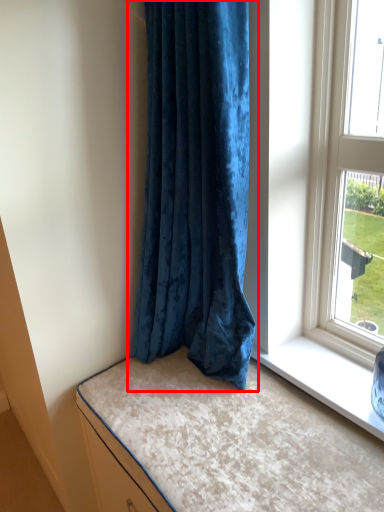
Question: Considering the relative positions of curtain (annotated by the red box) and bed in the image provided, where is curtain (annotated by the red box) located with respect to the staircase?

Choices:
 (A) right
 (B) left

Answer: (B)